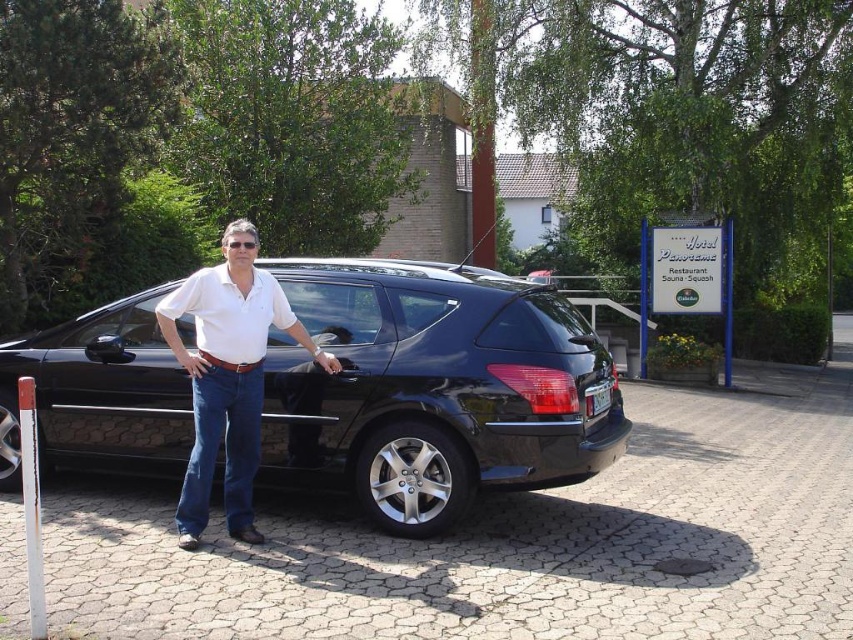
You are a photographer trying to capture a photo of the glossy black car at center and the white cotton shirt at center. Since the car is shorter than the white cotton shirt, how should you adjust your camera angle to ensure both are fully visible in the frame?

The glossy black car at center is shorter than the white cotton shirt at center. To capture both fully in the frame, position the camera slightly lower so that the shirt is not cropped at the top while still including the entire car.